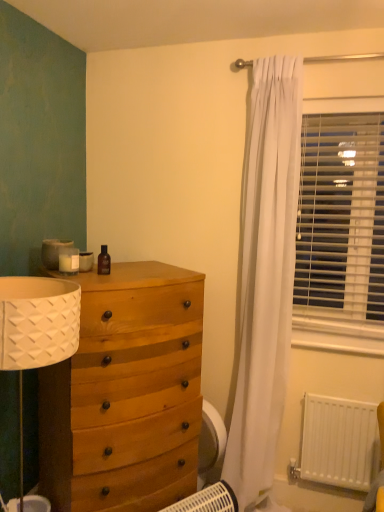
I want to click on vacant area located to the right-hand side of brown glass bottle at upper center, so click(x=140, y=279).